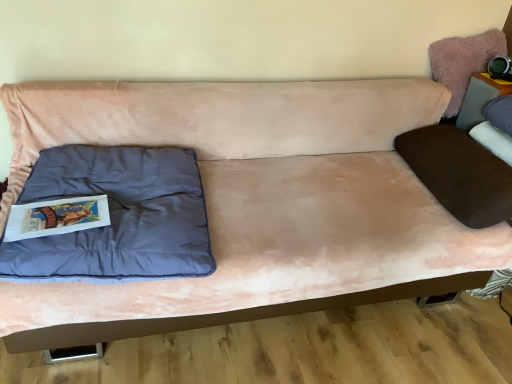
Find the location of a particular element. The height and width of the screenshot is (384, 512). matte gray table at upper right is located at coordinates (479, 98).

Describe the element at coordinates (463, 63) in the screenshot. I see `fuzzy pink pillow at upper right` at that location.

This screenshot has width=512, height=384. What do you see at coordinates (117, 216) in the screenshot?
I see `matte blue pillow at left` at bounding box center [117, 216].

Where is `matte gray table at upper right`? matte gray table at upper right is located at coordinates (479, 98).

Is matte blue pillow at left oriented away from pink suede couch at center?

Yes, pink suede couch at center is at the back of matte blue pillow at left.

Is pink suede couch at center located within matte blue pillow at left?

Actually, pink suede couch at center is outside matte blue pillow at left.

Can you confirm if matte blue pillow at left is shorter than pink suede couch at center?

Indeed, matte blue pillow at left has a lesser height compared to pink suede couch at center.

From a real-world perspective, is fuzzy pink pillow at upper right physically above matte gray table at upper right?

Indeed, from a real-world perspective, fuzzy pink pillow at upper right stands above matte gray table at upper right.

Is fuzzy pink pillow at upper right closer to the viewer compared to matte gray table at upper right?

No, fuzzy pink pillow at upper right is further to the viewer.

Looking at this image, which object is positioned more to the left, fuzzy pink pillow at upper right or matte gray table at upper right?

fuzzy pink pillow at upper right is more to the left.

Does point (498, 55) come in front of point (485, 103)?

No.

Between pink suede couch at center and matte gray table at upper right, which one has smaller width?

matte gray table at upper right is thinner.

Can you tell me how much pink suede couch at center and matte gray table at upper right differ in facing direction?

pink suede couch at center and matte gray table at upper right are facing 90.3 degrees away from each other.

Is pink suede couch at center positioned with its back to matte gray table at upper right?

pink suede couch at center does not have its back to matte gray table at upper right.

Considering the sizes of pink suede couch at center and fuzzy pink pillow at upper right in the image, is pink suede couch at center bigger or smaller than fuzzy pink pillow at upper right?

In the image, pink suede couch at center appears to be larger than fuzzy pink pillow at upper right.

Based on the photo, considering the sizes of objects pink suede couch at center and fuzzy pink pillow at upper right in the image provided, who is shorter, pink suede couch at center or fuzzy pink pillow at upper right?

fuzzy pink pillow at upper right is shorter.

Is point (179, 127) closer to viewer compared to point (438, 68)?

Yes, it is.

From a real-world perspective, is pink suede couch at center physically located above or below fuzzy pink pillow at upper right?

Clearly, from a real-world perspective, pink suede couch at center is below fuzzy pink pillow at upper right.

From the image's perspective, is matte blue pillow at left located above matte gray table at upper right?

No, from the image's perspective, matte blue pillow at left is not above matte gray table at upper right.

Relative to matte gray table at upper right, is matte blue pillow at left in front or behind?

Clearly, matte blue pillow at left is in front of matte gray table at upper right.

Which point is more forward, (149, 247) or (478, 85)?

The point (149, 247) is more forward.

Which object is positioned more to the left, fuzzy pink pillow at upper right or pink suede couch at center?

pink suede couch at center is more to the left.

Looking at their sizes, would you say fuzzy pink pillow at upper right is wider or thinner than pink suede couch at center?

In the image, fuzzy pink pillow at upper right appears to be more narrow than pink suede couch at center.

Which of these two, fuzzy pink pillow at upper right or pink suede couch at center, stands shorter?

With less height is fuzzy pink pillow at upper right.

Can pink suede couch at center be found inside fuzzy pink pillow at upper right?

No, pink suede couch at center is not surrounded by fuzzy pink pillow at upper right.

Is matte gray table at upper right facing towards pink suede couch at center?

Yes, matte gray table at upper right is facing pink suede couch at center.

How different are the orientations of matte gray table at upper right and pink suede couch at center in degrees?

matte gray table at upper right and pink suede couch at center are facing 90.3 degrees away from each other.

Between point (498, 94) and point (338, 282), which one is positioned behind?

The point (498, 94) is behind.

Can you confirm if matte gray table at upper right is smaller than pink suede couch at center?

Indeed, matte gray table at upper right has a smaller size compared to pink suede couch at center.

What are the coordinates of `studio couch above the matte blue pillow at left (from the image's perspective)` in the screenshot? It's located at (255, 203).

Where is `swivel chair above the matte gray table at upper right (from a real-world perspective)`? The width and height of the screenshot is (512, 384). swivel chair above the matte gray table at upper right (from a real-world perspective) is located at coordinates (463, 63).

Considering their positions, is matte blue pillow at left positioned further to matte gray table at upper right than fuzzy pink pillow at upper right?

matte blue pillow at left is positioned further to the anchor matte gray table at upper right.

From the image, which object appears to be farther from matte gray table at upper right, pink suede couch at center or matte blue pillow at left?

The object further to matte gray table at upper right is matte blue pillow at left.

Considering their positions, is fuzzy pink pillow at upper right positioned further to matte gray table at upper right than matte blue pillow at left?

matte blue pillow at left is further to matte gray table at upper right.

Considering their positions, is matte blue pillow at left positioned further to pink suede couch at center than fuzzy pink pillow at upper right?

fuzzy pink pillow at upper right is positioned further to the anchor pink suede couch at center.

In the scene shown: When comparing their distances from pink suede couch at center, does fuzzy pink pillow at upper right or matte gray table at upper right seem closer?

Among the two, fuzzy pink pillow at upper right is located nearer to pink suede couch at center.

Estimate the real-world distances between objects in this image. Which object is closer to pink suede couch at center, matte gray table at upper right or fuzzy pink pillow at upper right?

fuzzy pink pillow at upper right is positioned closer to the anchor pink suede couch at center.

Which object lies nearer to the anchor point fuzzy pink pillow at upper right, pink suede couch at center or matte blue pillow at left?

The object closer to fuzzy pink pillow at upper right is pink suede couch at center.

Estimate the real-world distances between objects in this image. Which object is further from matte blue pillow at left, fuzzy pink pillow at upper right or matte gray table at upper right?

matte gray table at upper right is positioned further to the anchor matte blue pillow at left.

You are a GUI agent. You are given a task and a screenshot of the screen. Output one action in this format:
    pyautogui.click(x=<x>, y=<y>)
    Task: Click on the studio couch between matte blue pillow at left and fuzzy pink pillow at upper right from left to right
    This screenshot has width=512, height=384.
    Given the screenshot: What is the action you would take?
    pyautogui.click(x=255, y=203)

This screenshot has width=512, height=384. What are the coordinates of `studio couch located between matte blue pillow at left and matte gray table at upper right in the left-right direction` in the screenshot? It's located at (255, 203).

Where is `swivel chair between pink suede couch at center and matte gray table at upper right`? swivel chair between pink suede couch at center and matte gray table at upper right is located at coordinates (463, 63).

Identify the location of swivel chair between matte blue pillow at left and matte gray table at upper right in the horizontal direction. (463, 63).